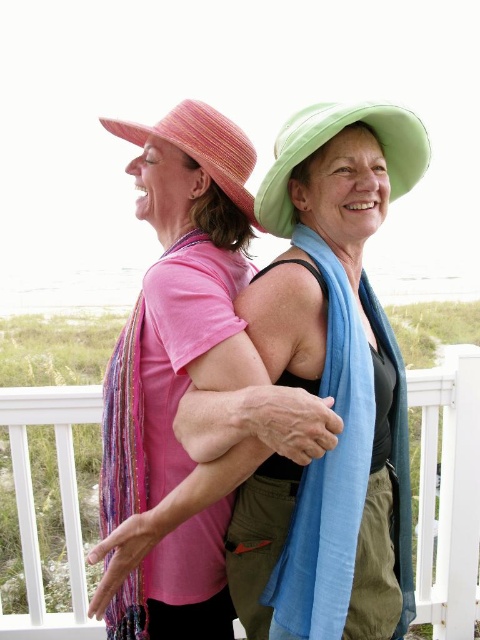
Question: Does matte green hat at center have a smaller size compared to blue silk scarf at center?

Choices:
 (A) yes
 (B) no

Answer: (B)

Question: Which object is farther from the camera taking this photo?

Choices:
 (A) green fabric hat at upper center
 (B) matte green hat at center
 (C) white wooden railing at center

Answer: (C)

Question: Which point is closer to the camera taking this photo?

Choices:
 (A) (398, 349)
 (B) (407, 444)
 (C) (420, 426)
 (D) (303, 109)

Answer: (D)

Question: Observing the image, what is the correct spatial positioning of white wooden railing at center in reference to pink straw hat at upper left?

Choices:
 (A) above
 (B) below

Answer: (B)

Question: Can you confirm if matte green hat at center is bigger than green fabric hat at upper center?

Choices:
 (A) yes
 (B) no

Answer: (A)

Question: Among these objects, which one is nearest to the camera?

Choices:
 (A) blue silk scarf at center
 (B) pink straw hat at upper left
 (C) pink woven scarf at left

Answer: (A)